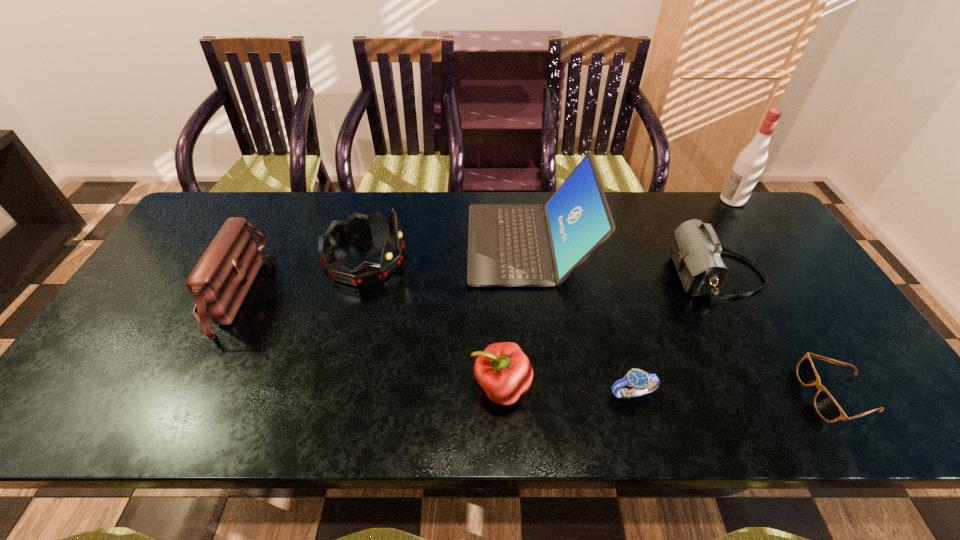
Identify which object is located as the third nearest to the seventh object from right to left. Please provide its 2D coordinates. Your answer should be formatted as a tuple, i.e. [(x, y)], where the tuple contains the x and y coordinates of a point satisfying the conditions above.

[(505, 373)]

Identify the location of free space that satisfies the following two spatial constraints: 1. on the front flap of the bell pepper; 2. on the left side of the left shoulder bag. The height and width of the screenshot is (540, 960). (182, 387).

Locate an element on the screen. This screenshot has width=960, height=540. vacant space that satisfies the following two spatial constraints: 1. at the front of the seventh object from right to left with jewels; 2. on the left side of the seventh tallest object is located at coordinates (330, 393).

Where is `free spot that satisfies the following two spatial constraints: 1. on the screen of the seventh shortest object; 2. on the right side of the second shortest object`? Image resolution: width=960 pixels, height=540 pixels. free spot that satisfies the following two spatial constraints: 1. on the screen of the seventh shortest object; 2. on the right side of the second shortest object is located at coordinates (546, 393).